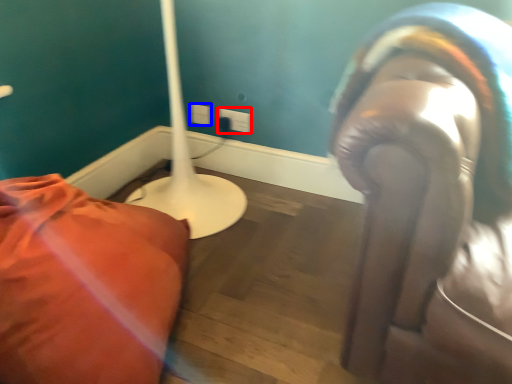
Question: Among these objects, which one is farthest to the camera, electric outlet (highlighted by a red box) or electric outlet (highlighted by a blue box)?

Choices:
 (A) electric outlet
 (B) electric outlet

Answer: (B)